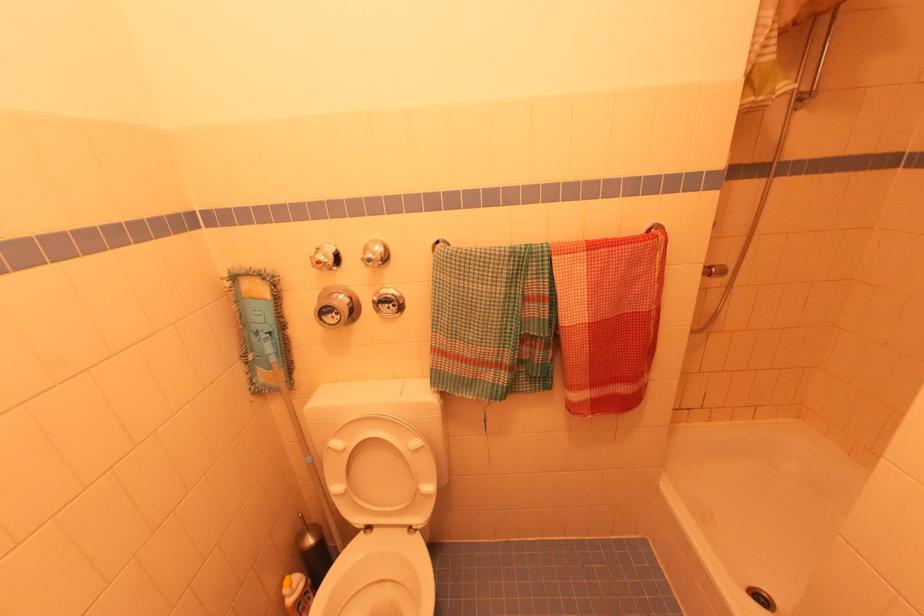
The height and width of the screenshot is (616, 924). I want to click on large wall dial, so click(x=336, y=306).